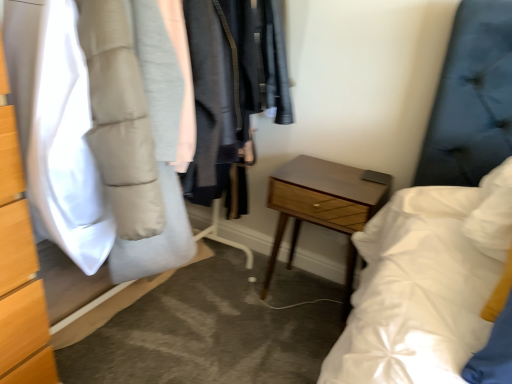
Question: Should I look upward or downward to see woodenmaterial/texturenightstand at center?

Choices:
 (A) up
 (B) down

Answer: (B)

Question: Is woodenmaterial/texturenightstand at center turned away from matte gray puffer jacket at left?

Choices:
 (A) no
 (B) yes

Answer: (A)

Question: Are woodenmaterial/texturenightstand at center and matte gray puffer jacket at left far apart?

Choices:
 (A) no
 (B) yes

Answer: (A)

Question: Can matte gray puffer jacket at left be found inside woodenmaterial/texturenightstand at center?

Choices:
 (A) no
 (B) yes

Answer: (A)

Question: Is woodenmaterial/texturenightstand at center at the right side of matte gray puffer jacket at left?

Choices:
 (A) yes
 (B) no

Answer: (A)

Question: Considering the relative sizes of woodenmaterial/texturenightstand at center and matte gray puffer jacket at left in the image provided, is woodenmaterial/texturenightstand at center smaller than matte gray puffer jacket at left?

Choices:
 (A) no
 (B) yes

Answer: (B)

Question: Is the depth of woodenmaterial/texturenightstand at center less than that of matte gray puffer jacket at left?

Choices:
 (A) yes
 (B) no

Answer: (B)

Question: Is white matte puffer jacket at left to the right of woodenmaterial/texturenightstand at center from the viewer's perspective?

Choices:
 (A) no
 (B) yes

Answer: (A)

Question: Is white matte puffer jacket at left positioned beyond the bounds of woodenmaterial/texturenightstand at center?

Choices:
 (A) yes
 (B) no

Answer: (A)

Question: Is white matte puffer jacket at left behind woodenmaterial/texturenightstand at center?

Choices:
 (A) no
 (B) yes

Answer: (A)

Question: Is white matte puffer jacket at left far away from woodenmaterial/texturenightstand at center?

Choices:
 (A) no
 (B) yes

Answer: (A)

Question: Can you confirm if white matte puffer jacket at left is smaller than woodenmaterial/texturenightstand at center?

Choices:
 (A) no
 (B) yes

Answer: (B)

Question: Is white matte puffer jacket at left next to woodenmaterial/texturenightstand at center?

Choices:
 (A) yes
 (B) no

Answer: (B)

Question: Does matte gray puffer jacket at left lie behind white matte puffer jacket at left?

Choices:
 (A) yes
 (B) no

Answer: (B)